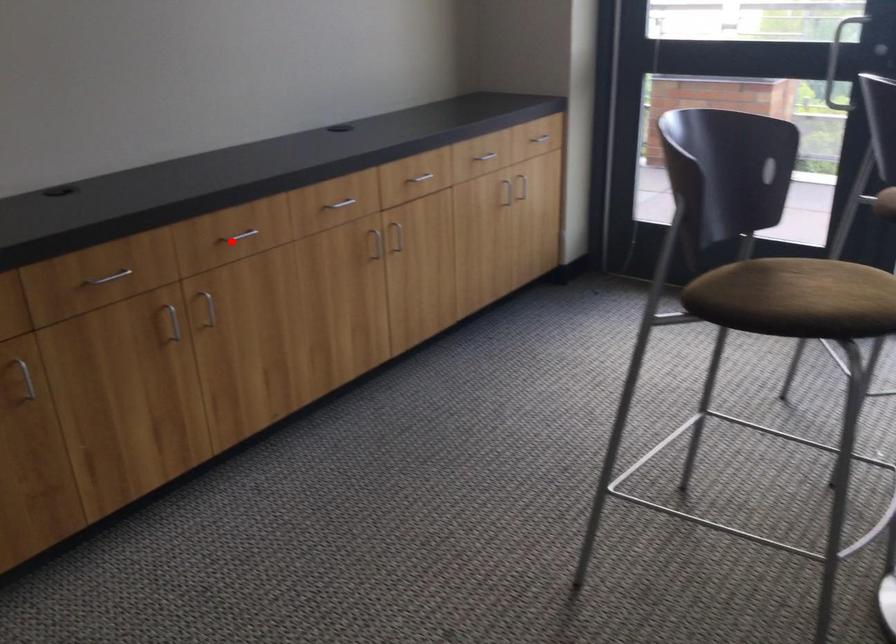
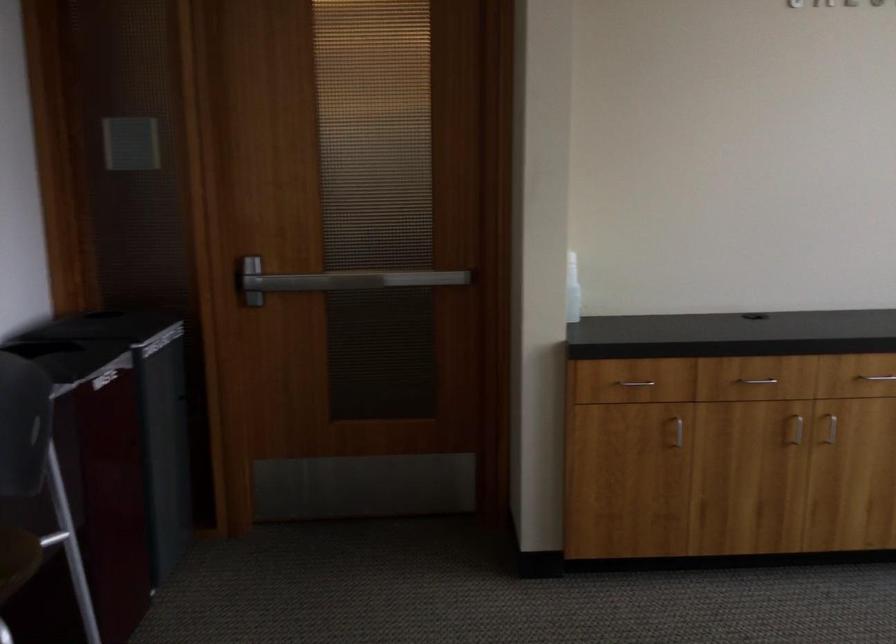
In the second image, find the point that corresponds to the highlighted location in the first image.

(874, 382)